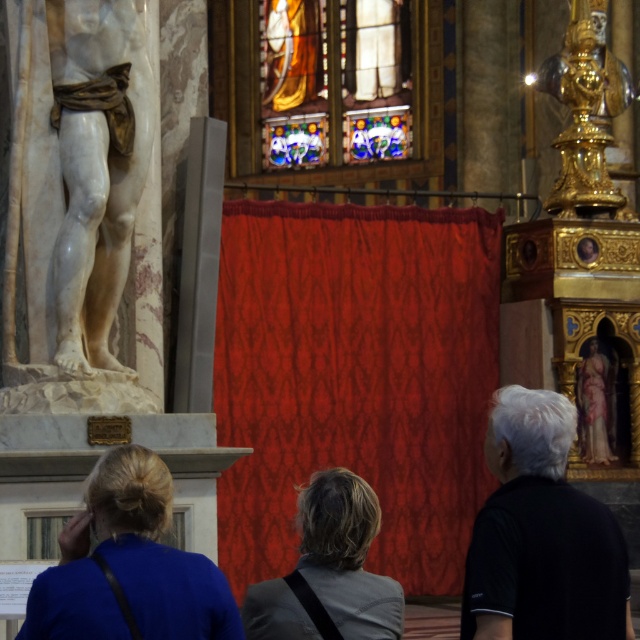
Question: Does blue fabric at lower left appear on the right side of gray fabric jacket at center?

Choices:
 (A) no
 (B) yes

Answer: (A)

Question: Which object is positioned farthest from the black fabric at lower right?

Choices:
 (A) white marble statue at left
 (B) gray fabric jacket at center

Answer: (A)

Question: Estimate the real-world distances between objects in this image. Which object is farther from the gold/gilded statue at upper right?

Choices:
 (A) stained glass window at upper center
 (B) blue fabric at lower left
 (C) white marble statue at left
 (D) black fabric at lower right

Answer: (B)

Question: Does blue fabric at lower left have a larger size compared to stained glass window at upper center?

Choices:
 (A) yes
 (B) no

Answer: (A)

Question: Does black fabric at lower right have a smaller size compared to stained glass window at upper center?

Choices:
 (A) yes
 (B) no

Answer: (B)

Question: Which of the following is the farthest from the observer?

Choices:
 (A) stained glass window at upper center
 (B) blue fabric at lower left
 (C) black fabric at lower right
 (D) gold/gilded statue at upper right

Answer: (A)